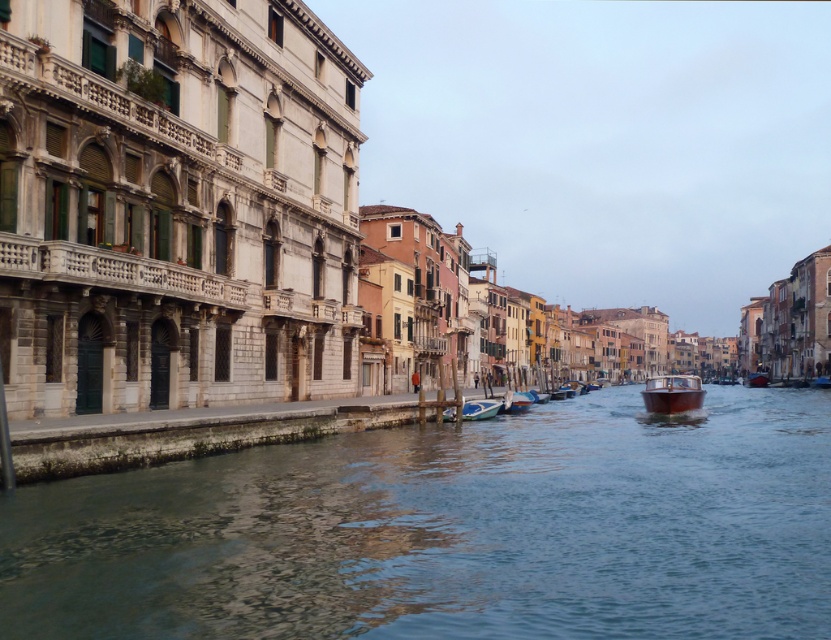
Question: Which point appears farthest from the camera in this image?

Choices:
 (A) (702, 392)
 (B) (514, 563)

Answer: (A)

Question: Does wooden boat at center appear over light blue wooden boat at center?

Choices:
 (A) no
 (B) yes

Answer: (A)

Question: Which of these objects is positioned farthest from the light blue wooden boat at center?

Choices:
 (A) wooden boat at center
 (B) clear water at center
 (C) metallic blue boat at center

Answer: (A)

Question: Is shiny red boat at center wider than wooden polished boat at center?

Choices:
 (A) yes
 (B) no

Answer: (A)

Question: Among these objects, which one is nearest to the camera?

Choices:
 (A) wooden boat at center
 (B) metallic blue boat at center
 (C) wooden polished boat at center
 (D) shiny red boat at center

Answer: (A)

Question: Can you confirm if clear water at center is positioned to the left of wooden boat at center?

Choices:
 (A) no
 (B) yes

Answer: (B)